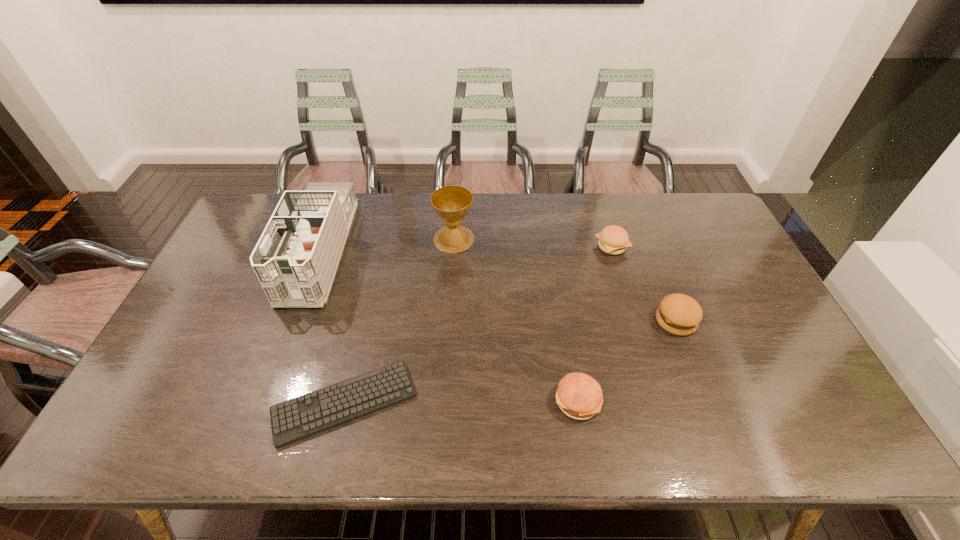
Image resolution: width=960 pixels, height=540 pixels. Identify the location of empty space that is in between the fifth tallest object and the rightmost object. (627, 361).

The height and width of the screenshot is (540, 960). I want to click on unoccupied area between the computer keyboard and the leftmost hamburger, so click(461, 402).

The height and width of the screenshot is (540, 960). What are the coordinates of `empty space that is in between the dollhouse and the fifth tallest object` in the screenshot? It's located at (448, 326).

Find the location of a particular element. object that is the fifth closest to the chalice is located at coordinates point(679,314).

Locate which object is the fourth closest to the dollhouse. Please provide its 2D coordinates. Your answer should be formatted as a tuple, i.e. [(x, y)], where the tuple contains the x and y coordinates of a point satisfying the conditions above.

[(614, 240)]

You are a GUI agent. You are given a task and a screenshot of the screen. Output one action in this format:
    pyautogui.click(x=<x>, y=<y>)
    Task: Click on the second closest hamburger to the leftmost hamburger
    The image size is (960, 540).
    Given the screenshot: What is the action you would take?
    pyautogui.click(x=614, y=240)

Locate an element on the screen. The height and width of the screenshot is (540, 960). hamburger that is the second closest to the rightmost hamburger is located at coordinates (579, 396).

The height and width of the screenshot is (540, 960). Find the location of `vacant space that satisfies the following two spatial constraints: 1. on the front side of the rightmost object; 2. on the left side of the farthest hamburger`. vacant space that satisfies the following two spatial constraints: 1. on the front side of the rightmost object; 2. on the left side of the farthest hamburger is located at coordinates (635, 321).

At what (x,y) coordinates should I click in order to perform the action: click on free space in the image that satisfies the following two spatial constraints: 1. on the back side of the third object from right to left; 2. on the left side of the rightmost hamburger. Please return your answer as a coordinate pair (x, y). Looking at the image, I should click on (564, 321).

At what (x,y) coordinates should I click in order to perform the action: click on free location that satisfies the following two spatial constraints: 1. on the back side of the farthest hamburger; 2. on the right side of the shortest object. Please return your answer as a coordinate pair (x, y). Looking at the image, I should click on (381, 247).